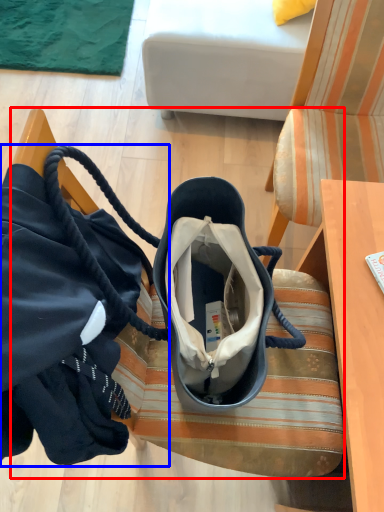
Question: Which object is closer to the camera taking this photo, furniture (highlighted by a red box) or handbag (highlighted by a blue box)?

Choices:
 (A) furniture
 (B) handbag

Answer: (B)